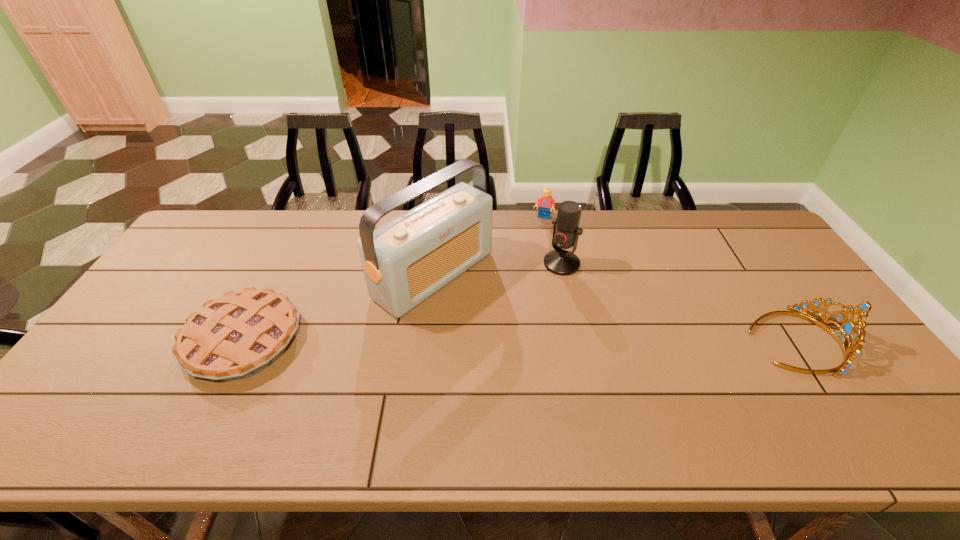
Identify the location of Lego at the far edge. pos(546,203).

Where is `radio receiver located in the far edge section of the desktop`? The height and width of the screenshot is (540, 960). radio receiver located in the far edge section of the desktop is located at coordinates (405, 261).

Locate an element on the screen. Image resolution: width=960 pixels, height=540 pixels. pie located in the near edge section of the desktop is located at coordinates (236, 336).

In order to click on tiara present at the near edge in this screenshot , I will do `click(847, 328)`.

The height and width of the screenshot is (540, 960). Identify the location of object at the right edge. (847, 328).

Where is `object that is at the near right corner`? object that is at the near right corner is located at coordinates (847, 328).

Where is `vacant space at the far edge of the desktop`? vacant space at the far edge of the desktop is located at coordinates click(x=643, y=242).

The image size is (960, 540). In the image, there is a desktop. Find the location of `vacant region at the left edge`. vacant region at the left edge is located at coordinates (126, 366).

Image resolution: width=960 pixels, height=540 pixels. I want to click on blank space at the right edge of the desktop, so click(x=795, y=278).

This screenshot has width=960, height=540. What are the coordinates of `vacant region at the near left corner of the desktop` in the screenshot? It's located at (133, 379).